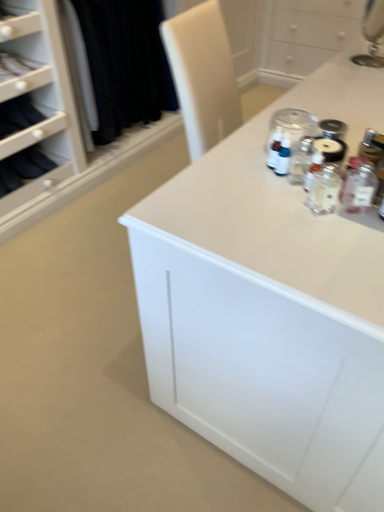
Question: Is clear glass bottle at center, acting as the second bottle starting from the right, in front of or behind clear glass bottle at right, positioned as the second bottle in left-to-right order, in the image?

Choices:
 (A) behind
 (B) front

Answer: (A)

Question: From a real-world perspective, is clear glass bottle at center, acting as the second bottle starting from the right, positioned above or below clear glass bottle at right, positioned as the second bottle in left-to-right order?

Choices:
 (A) below
 (B) above

Answer: (A)

Question: Estimate the real-world distances between objects in this image. Which object is farther from the matte black fabric at upper left?

Choices:
 (A) clear glass bottle at center, acting as the second bottle starting from the right
 (B) clear glass jar at upper center
 (C) clear glass bottle at right, positioned as the second bottle in left-to-right order
 (D) white glossy countertop at upper right

Answer: (C)

Question: Estimate the real-world distances between objects in this image. Which object is closer to the matte black fabric at upper left?

Choices:
 (A) clear glass bottle at right, positioned as the second bottle in left-to-right order
 (B) clear glass bottle at center, acting as the second bottle starting from the right
 (C) clear glass jar at upper center
 (D) white glossy countertop at upper right

Answer: (C)